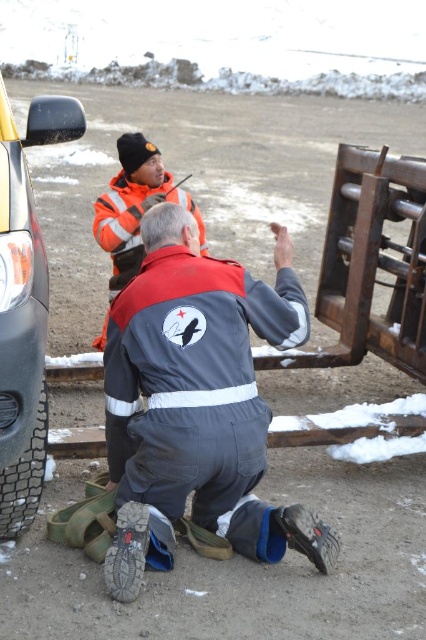
You are a delivery person trying to locate a missing package. The package is hidden either on the gray fabric jumpsuit at center or the black rubber tire at left. According to the scene description, which object is more to the right and could potentially hide the package there?

The gray fabric jumpsuit at center is positioned on the right side of the black rubber tire at left, so the gray fabric jumpsuit at center is more to the right and could potentially hide the package there.

You are a delivery person who needs to retrieve your gray fabric jumpsuit at center. There is a black rubber tire at left blocking your path. Can you step over the tire to reach your jumpsuit?

The black rubber tire at left is behind gray fabric jumpsuit at center, so the tire is not blocking your path. You can safely step forward to retrieve your gray fabric jumpsuit at center without needing to step over the tire.

You are standing at the point with coordinates point (0, 506) and want to move towards the point (22, 237). Which direction should you move in?

You should move towards the point (22, 237) because it is closer to the viewer than the point (0, 506) where you are currently standing.